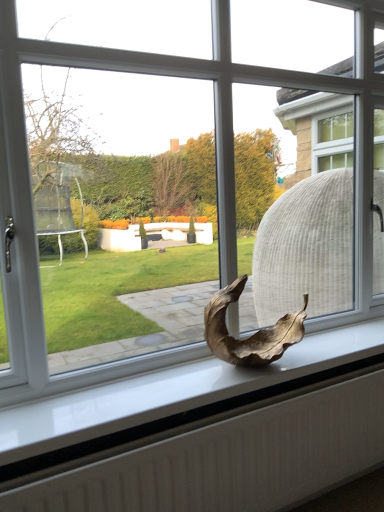
Question: Is dry leaf at center positioned with its back to white textured radiator at lower center?

Choices:
 (A) yes
 (B) no

Answer: (B)

Question: Could you tell me if dry leaf at center is turned towards white textured radiator at lower center?

Choices:
 (A) no
 (B) yes

Answer: (A)

Question: Is dry leaf at center further to camera compared to white textured radiator at lower center?

Choices:
 (A) no
 (B) yes

Answer: (B)

Question: Is there a large distance between dry leaf at center and white textured radiator at lower center?

Choices:
 (A) no
 (B) yes

Answer: (A)

Question: From the image's perspective, would you say dry leaf at center is positioned over white textured radiator at lower center?

Choices:
 (A) yes
 (B) no

Answer: (A)

Question: Can you confirm if dry leaf at center is positioned to the left of white textured radiator at lower center?

Choices:
 (A) no
 (B) yes

Answer: (A)

Question: Is the position of white textured radiator at lower center more distant than that of dry leaf at center?

Choices:
 (A) yes
 (B) no

Answer: (B)

Question: From the image's perspective, is white textured radiator at lower center beneath dry leaf at center?

Choices:
 (A) no
 (B) yes

Answer: (B)

Question: Does white textured radiator at lower center have a lesser height compared to dry leaf at center?

Choices:
 (A) yes
 (B) no

Answer: (B)

Question: From a real-world perspective, does white textured radiator at lower center stand above dry leaf at center?

Choices:
 (A) yes
 (B) no

Answer: (B)

Question: From the image's perspective, does white textured radiator at lower center appear higher than dry leaf at center?

Choices:
 (A) no
 (B) yes

Answer: (A)

Question: Does white textured radiator at lower center have a larger size compared to dry leaf at center?

Choices:
 (A) yes
 (B) no

Answer: (A)

Question: From their relative heights in the image, would you say dry leaf at center is taller or shorter than white textured radiator at lower center?

Choices:
 (A) short
 (B) tall

Answer: (A)